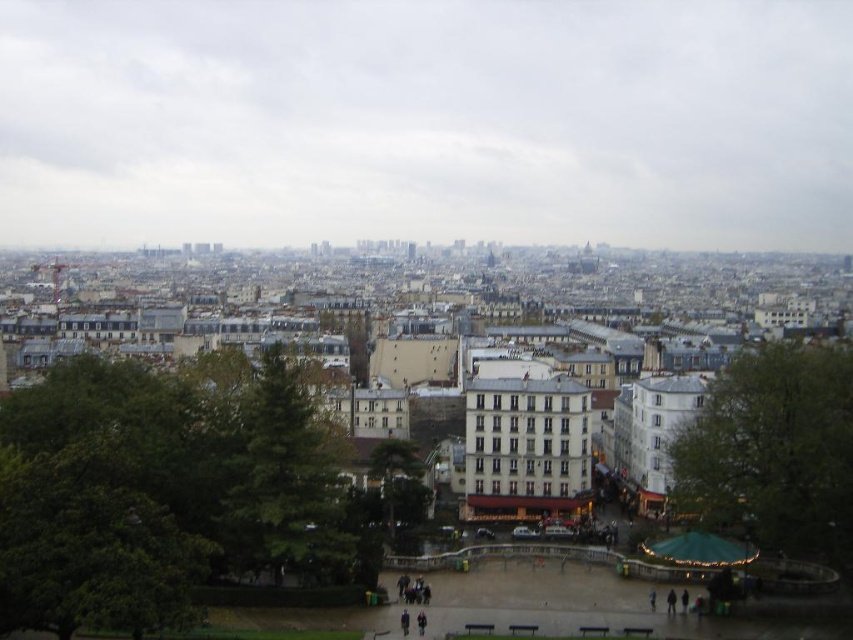
You are a photographer standing in the park area. You want to take a photo of the green textured tree at center and the dark clothing at center. Which object is wider in the scene?

The green textured tree at center is wider than the dark clothing at center according to the description.

You are a tourist standing in the park area and want to take a photo of the green leafy tree at center and the dark clothing at center. Which object will appear bigger in your photo?

The green leafy tree at center will appear bigger in the photo because it has a larger size compared to the dark clothing at center.